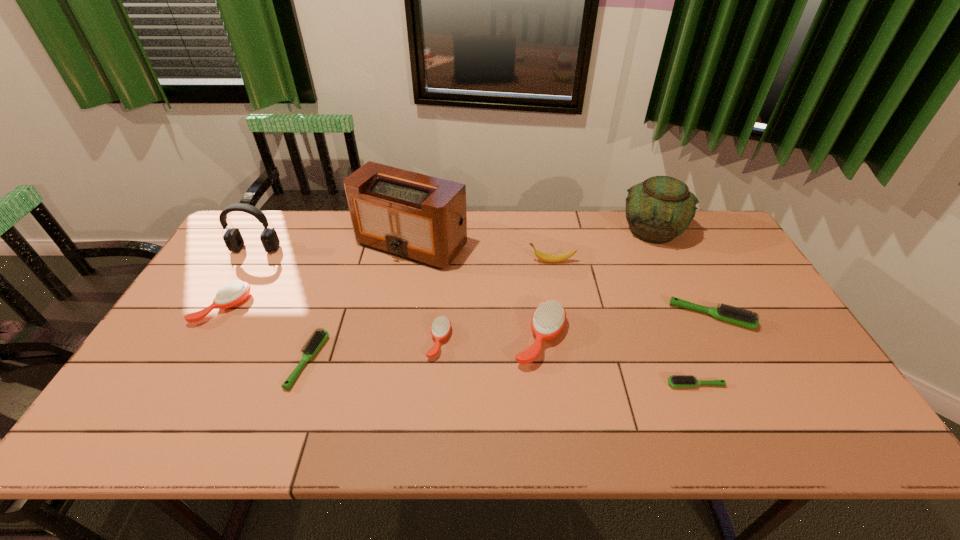
Where is `free area in between the yellow banana and the smallest light hairbrush`? This screenshot has height=540, width=960. free area in between the yellow banana and the smallest light hairbrush is located at coordinates (623, 323).

Locate an element on the screen. This screenshot has width=960, height=540. object that stands as the third closest to the leftmost hairbrush is located at coordinates (420, 218).

Select which object is the sixth closest to the leftmost hairbrush. Please provide its 2D coordinates. Your answer should be formatted as a tuple, i.e. [(x, y)], where the tuple contains the x and y coordinates of a point satisfying the conditions above.

[(553, 258)]

I want to click on hairbrush that is the fourth closest to the smallest orange hairbrush, so click(677, 381).

Point out which hairbrush is positioned as the nearest to the rightmost orange hairbrush. Please provide its 2D coordinates. Your answer should be formatted as a tuple, i.e. [(x, y)], where the tuple contains the x and y coordinates of a point satisfying the conditions above.

[(441, 326)]

Image resolution: width=960 pixels, height=540 pixels. In order to click on orange hairbrush that is the closest to the leftmost hairbrush in this screenshot , I will do `click(441, 326)`.

Identify which orange hairbrush is the second nearest to the farthest light hairbrush. Please provide its 2D coordinates. Your answer should be formatted as a tuple, i.e. [(x, y)], where the tuple contains the x and y coordinates of a point satisfying the conditions above.

[(441, 326)]

Identify which light hairbrush is the second closest to the biggest orange hairbrush. Please provide its 2D coordinates. Your answer should be formatted as a tuple, i.e. [(x, y)], where the tuple contains the x and y coordinates of a point satisfying the conditions above.

[(742, 317)]

Locate which light hairbrush ranks in proximity to the tallest object. Please provide its 2D coordinates. Your answer should be formatted as a tuple, i.e. [(x, y)], where the tuple contains the x and y coordinates of a point satisfying the conditions above.

[(316, 341)]

The width and height of the screenshot is (960, 540). In order to click on vacant area in the image that satisfies the following two spatial constraints: 1. on the headband of the headset; 2. on the right side of the fifth shortest hairbrush in this screenshot , I will do `click(222, 307)`.